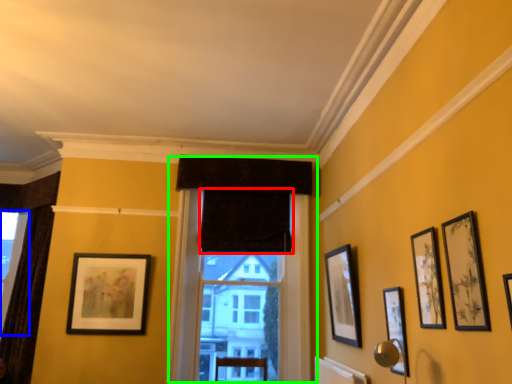
Question: Estimate the real-world distances between objects in this image. Which object is closer to curtain (highlighted by a red box), window (highlighted by a blue box) or window (highlighted by a green box)?

Choices:
 (A) window
 (B) window

Answer: (B)